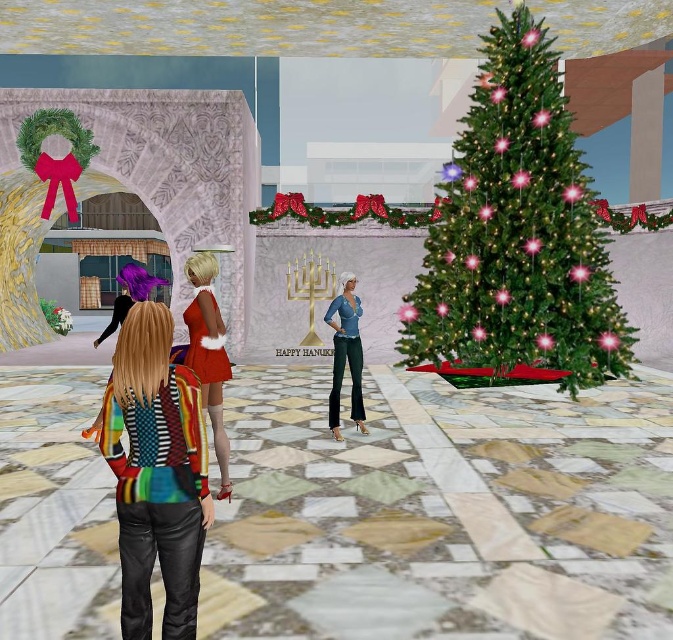
From the picture: Is shiny red dress at center taller than denim jeans at center?

Yes.

Which is more to the right, shiny red dress at center or denim jeans at center?

denim jeans at center

Which is in front, point (227, 451) or point (349, 312)?

Point (227, 451)

Find the location of `shiny red dress at center`. shiny red dress at center is located at coordinates (209, 353).

Is multicolored striped sweater at center to the right of denim jeans at center from the viewer's perspective?

In fact, multicolored striped sweater at center is to the left of denim jeans at center.

Is multicolored striped sweater at center positioned before denim jeans at center?

Yes, it is.

The height and width of the screenshot is (640, 673). What do you see at coordinates (155, 472) in the screenshot?
I see `multicolored striped sweater at center` at bounding box center [155, 472].

The image size is (673, 640). I want to click on multicolored striped sweater at center, so click(x=155, y=472).

Which is behind, point (606, 243) or point (199, 285)?

Point (606, 243)

Who is shorter, green matte christmas tree at right or shiny red dress at center?

With less height is green matte christmas tree at right.

Does point (540, 301) come behind point (213, 349)?

That is True.

The height and width of the screenshot is (640, 673). I want to click on green matte christmas tree at right, so click(518, 234).